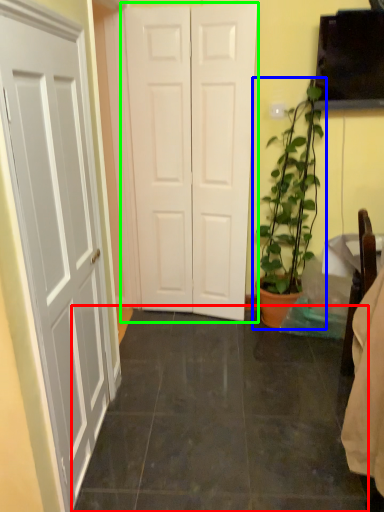
Question: Considering the real-world distances, which object is farthest from tile (highlighted by a red box)? houseplant (highlighted by a blue box) or door (highlighted by a green box)?

Choices:
 (A) houseplant
 (B) door

Answer: (B)